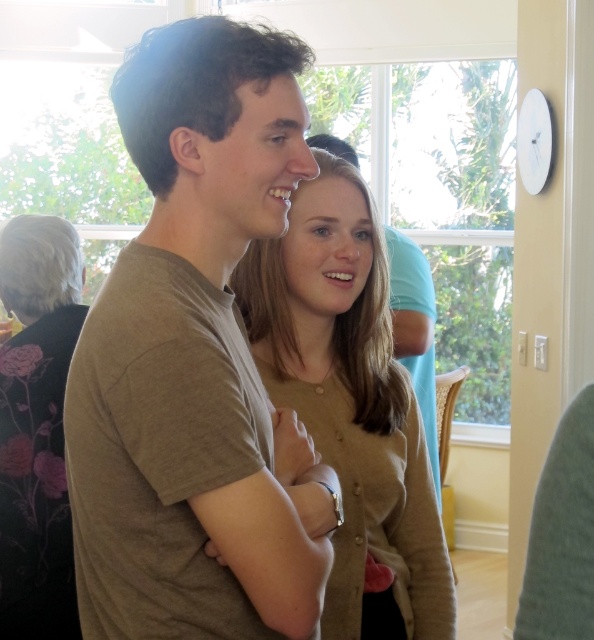
Does matte brown t-shirt at center have a greater height compared to black floral dress at left?

No.

Who is higher up, matte brown t-shirt at center or black floral dress at left?

Positioned higher is matte brown t-shirt at center.

At what (x,y) coordinates should I click in order to perform the action: click on matte brown t-shirt at center. Please return your answer as a coordinate pair (x, y). The width and height of the screenshot is (594, 640). Looking at the image, I should click on (195, 360).

Image resolution: width=594 pixels, height=640 pixels. I want to click on matte brown t-shirt at center, so click(195, 360).

Looking at this image, between black floral dress at left and matte brown shirt at center, which one is positioned higher?

matte brown shirt at center

Can you confirm if black floral dress at left is thinner than matte brown shirt at center?

Indeed, black floral dress at left has a lesser width compared to matte brown shirt at center.

Is point (34, 413) positioned after point (397, 278)?

No, it is not.

You are a GUI agent. You are given a task and a screenshot of the screen. Output one action in this format:
    pyautogui.click(x=<x>, y=<y>)
    Task: Click on the black floral dress at left
    This screenshot has width=594, height=640.
    Given the screenshot: What is the action you would take?
    pyautogui.click(x=36, y=426)

Can you confirm if matte brown t-shirt at center is thinner than matte brown shirt at center?

No, matte brown t-shirt at center is not thinner than matte brown shirt at center.

Where is `matte brown t-shirt at center`? matte brown t-shirt at center is located at coordinates [x=195, y=360].